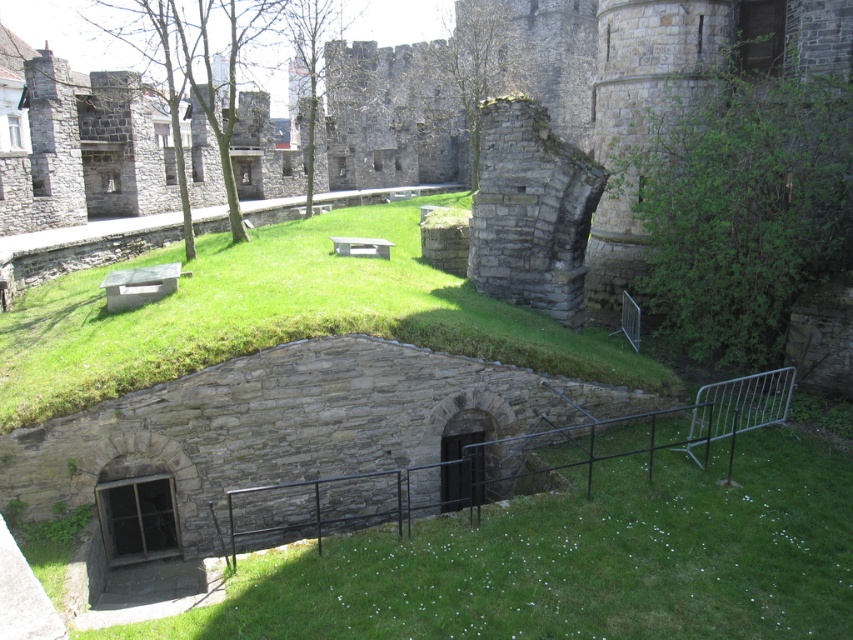
Question: Which point is farther to the camera?

Choices:
 (A) green grassy at lower center
 (B) green grassy at center

Answer: (B)

Question: Does green grassy at lower center have a greater width compared to green grassy at center?

Choices:
 (A) yes
 (B) no

Answer: (B)

Question: Is green grassy at lower center smaller than green grassy at center?

Choices:
 (A) yes
 (B) no

Answer: (A)

Question: Is green grassy at lower center to the right of green grassy at center from the viewer's perspective?

Choices:
 (A) no
 (B) yes

Answer: (B)

Question: Which object appears closest to the camera in this image?

Choices:
 (A) green grassy at lower center
 (B) green grassy at center

Answer: (A)

Question: Which object is closer to the camera taking this photo?

Choices:
 (A) green grassy at center
 (B) green grassy at lower center

Answer: (B)